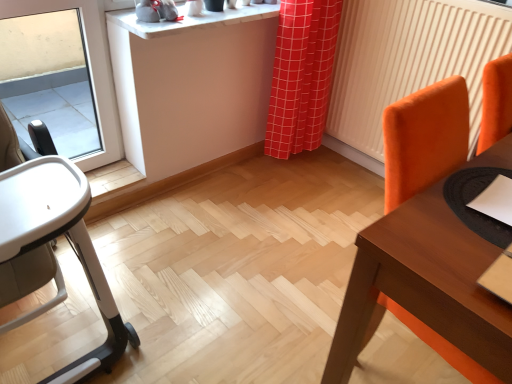
Question: From a real-world perspective, is white marble counter top at upper center located beneath wooden table at right?

Choices:
 (A) yes
 (B) no

Answer: (B)

Question: Considering the relative positions of white marble counter top at upper center and wooden table at right in the image provided, is white marble counter top at upper center to the left of wooden table at right from the viewer's perspective?

Choices:
 (A) yes
 (B) no

Answer: (A)

Question: From the image's perspective, would you say white marble counter top at upper center is shown under wooden table at right?

Choices:
 (A) yes
 (B) no

Answer: (B)

Question: Is white marble counter top at upper center wider than wooden table at right?

Choices:
 (A) yes
 (B) no

Answer: (B)

Question: Considering the relative sizes of white marble counter top at upper center and wooden table at right in the image provided, is white marble counter top at upper center taller than wooden table at right?

Choices:
 (A) no
 (B) yes

Answer: (A)

Question: Do you think white marble counter top at upper center is within orange fabric radiator at right, or outside of it?

Choices:
 (A) outside
 (B) inside

Answer: (A)

Question: From the image's perspective, is white marble counter top at upper center above or below orange fabric radiator at right?

Choices:
 (A) above
 (B) below

Answer: (A)

Question: Is point (119, 18) positioned closer to the camera than point (502, 18)?

Choices:
 (A) farther
 (B) closer

Answer: (A)

Question: Considering the positions of white marble counter top at upper center and orange fabric radiator at right in the image, is white marble counter top at upper center bigger or smaller than orange fabric radiator at right?

Choices:
 (A) small
 (B) big

Answer: (A)

Question: Is point (460, 254) closer or farther from the camera than point (458, 51)?

Choices:
 (A) closer
 (B) farther

Answer: (A)

Question: From the image's perspective, relative to orange fabric radiator at right, is wooden table at right above or below?

Choices:
 (A) below
 (B) above

Answer: (A)

Question: Considering the relative positions of wooden table at right and orange fabric radiator at right in the image provided, is wooden table at right to the left or to the right of orange fabric radiator at right?

Choices:
 (A) left
 (B) right

Answer: (B)

Question: From a real-world perspective, is wooden table at right positioned above or below orange fabric radiator at right?

Choices:
 (A) above
 (B) below

Answer: (B)

Question: Is orange fabric radiator at right inside or outside of wooden table at right?

Choices:
 (A) inside
 (B) outside

Answer: (B)

Question: In terms of width, does orange fabric radiator at right look wider or thinner when compared to wooden table at right?

Choices:
 (A) thin
 (B) wide

Answer: (A)